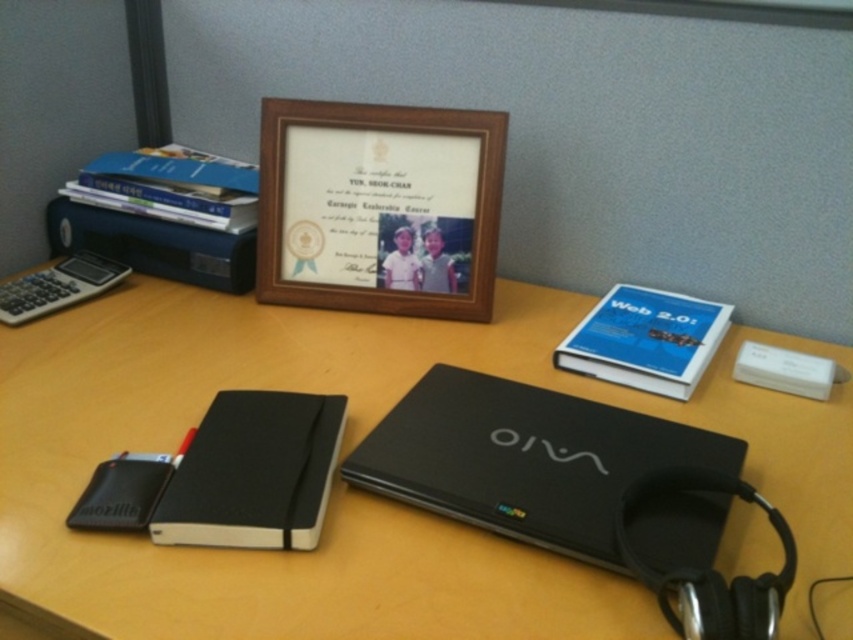
Is point (339, 188) farther from camera compared to point (592, 531)?

Yes, it is.

Can you confirm if wooden picture frame at upper center is positioned above black matte laptop at center?

Correct, wooden picture frame at upper center is located above black matte laptop at center.

At what (x,y) coordinates should I click in order to perform the action: click on wooden picture frame at upper center. Please return your answer as a coordinate pair (x, y). The width and height of the screenshot is (853, 640). Looking at the image, I should click on (379, 208).

Is point (560, 538) positioned in front of point (653, 577)?

That is False.

Which is in front, point (643, 472) or point (776, 509)?

Positioned in front is point (776, 509).

Find the location of `black matte laptop at center`. black matte laptop at center is located at coordinates (524, 458).

Does matte black laptop at center appear on the right side of black matte notebook at center?

Yes, matte black laptop at center is to the right of black matte notebook at center.

Can you confirm if matte black laptop at center is bigger than black matte notebook at center?

Indeed, matte black laptop at center has a larger size compared to black matte notebook at center.

Measure the distance between point [289,314] and camera.

3.56 feet

Locate an element on the screen. matte black laptop at center is located at coordinates (341, 483).